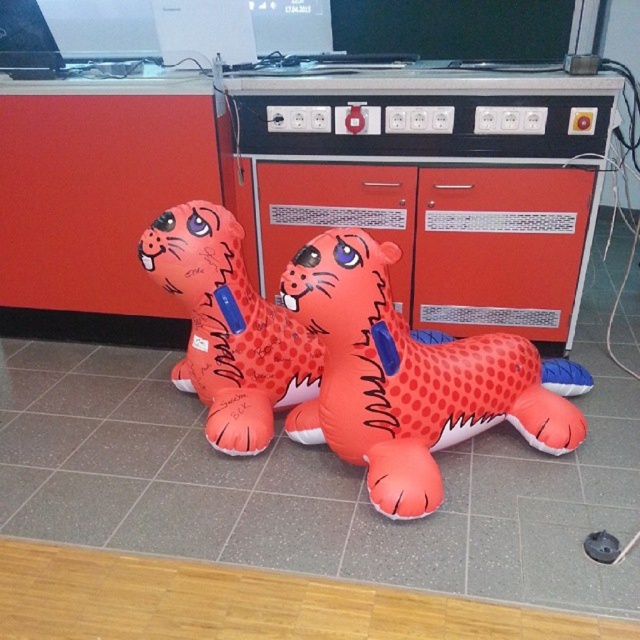
Is point (365, 378) closer to viewer compared to point (227, 252)?

That is True.

Does rubber/inflatable tiger at center appear on the right side of rubber orange tiger at center?

Correct, you'll find rubber/inflatable tiger at center to the right of rubber orange tiger at center.

Is point (385, 483) farther from camera compared to point (272, 385)?

No, (385, 483) is closer to viewer.

Identify the location of rubber/inflatable tiger at center. The height and width of the screenshot is (640, 640). pos(412,378).

Who is lower down, rubber inflatable tiger at center or rubber orange tiger at center?

rubber orange tiger at center is below.

Can you confirm if rubber inflatable tiger at center is positioned to the right of rubber orange tiger at center?

Correct, you'll find rubber inflatable tiger at center to the right of rubber orange tiger at center.

Which is behind, point (435, 305) or point (268, 323)?

The point (435, 305) is behind.

Where is `rubber inflatable tiger at center`? Image resolution: width=640 pixels, height=640 pixels. rubber inflatable tiger at center is located at coordinates (433, 182).

Can you confirm if rubber inflatable tiger at center is smaller than rubber/inflatable tiger at center?

Actually, rubber inflatable tiger at center might be larger than rubber/inflatable tiger at center.

What do you see at coordinates (433, 182) in the screenshot? I see `rubber inflatable tiger at center` at bounding box center [433, 182].

You are a GUI agent. You are given a task and a screenshot of the screen. Output one action in this format:
    pyautogui.click(x=<x>, y=<y>)
    Task: Click on the rubber inflatable tiger at center
    
    Given the screenshot: What is the action you would take?
    pyautogui.click(x=433, y=182)